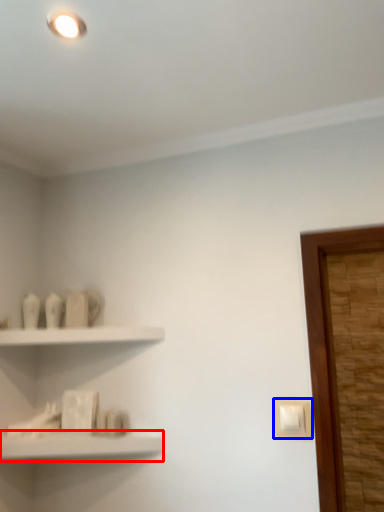
Question: Which object is closer to the camera taking this photo, shelf (highlighted by a red box) or light switch (highlighted by a blue box)?

Choices:
 (A) shelf
 (B) light switch

Answer: (A)